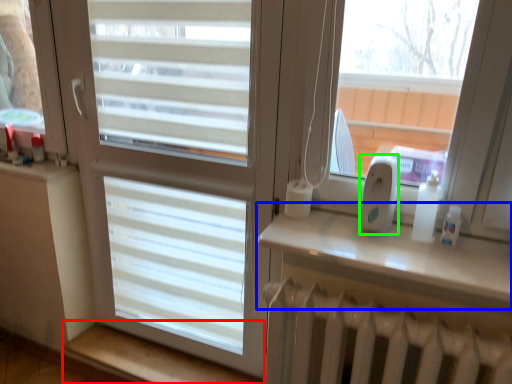
Question: Estimate the real-world distances between objects in this image. Which object is farther from window sill (highlighted by a red box), window sill (highlighted by a blue box) or ipod (highlighted by a green box)?

Choices:
 (A) window sill
 (B) ipod

Answer: (B)